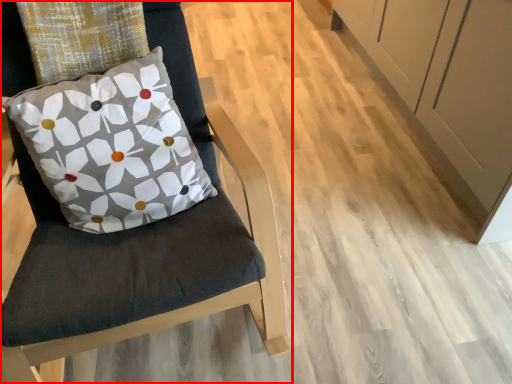
Question: From the image's perspective, considering the relative positions of chair (annotated by the red box) and pillow in the image provided, where is chair (annotated by the red box) located with respect to the staircase?

Choices:
 (A) below
 (B) above

Answer: (A)